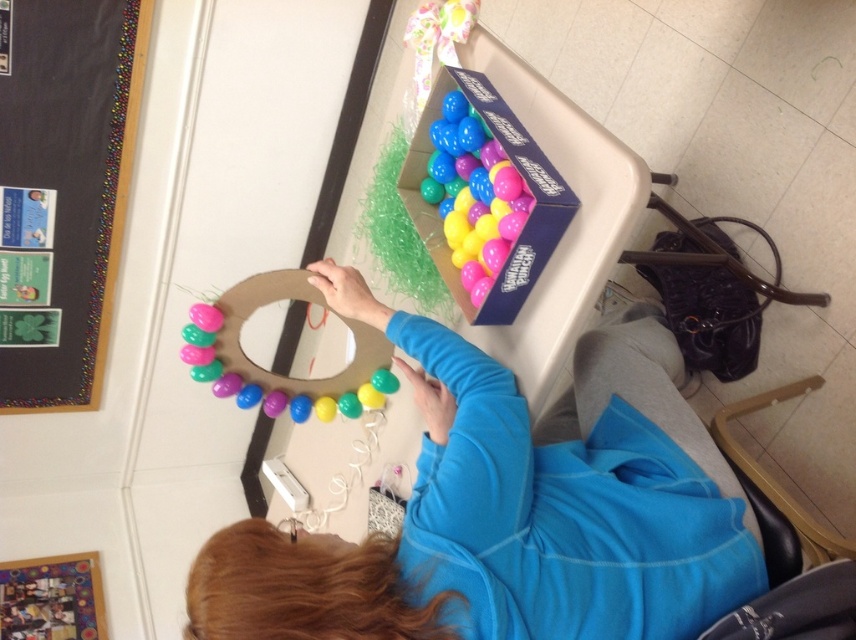
Can you confirm if black matte bulletin board at upper left is smaller than matte pink balloon at upper left?

Actually, black matte bulletin board at upper left might be larger than matte pink balloon at upper left.

Is point (84, 164) positioned in front of point (206, 307)?

That is False.

Does point (86, 305) come closer to viewer compared to point (198, 310)?

No.

Locate an element on the screen. The height and width of the screenshot is (640, 856). black matte bulletin board at upper left is located at coordinates (63, 189).

Locate an element on the screen. black matte bulletin board at upper left is located at coordinates (63, 189).

In the scene shown: Is black matte bulletin board at upper left positioned before matte plastic balloons at upper right?

No, it is behind matte plastic balloons at upper right.

Does point (22, 394) come in front of point (450, 224)?

No, (22, 394) is behind (450, 224).

Find the location of a particular element. The height and width of the screenshot is (640, 856). black matte bulletin board at upper left is located at coordinates (63, 189).

Is matte plastic egg wreath at center below matte plastic balloons at upper right?

Correct, matte plastic egg wreath at center is located below matte plastic balloons at upper right.

Between matte plastic egg wreath at center and matte plastic balloons at upper right, which one is positioned higher?

Positioned higher is matte plastic balloons at upper right.

Locate an element on the screen. matte plastic egg wreath at center is located at coordinates (503, 515).

I want to click on matte plastic egg wreath at center, so click(x=503, y=515).